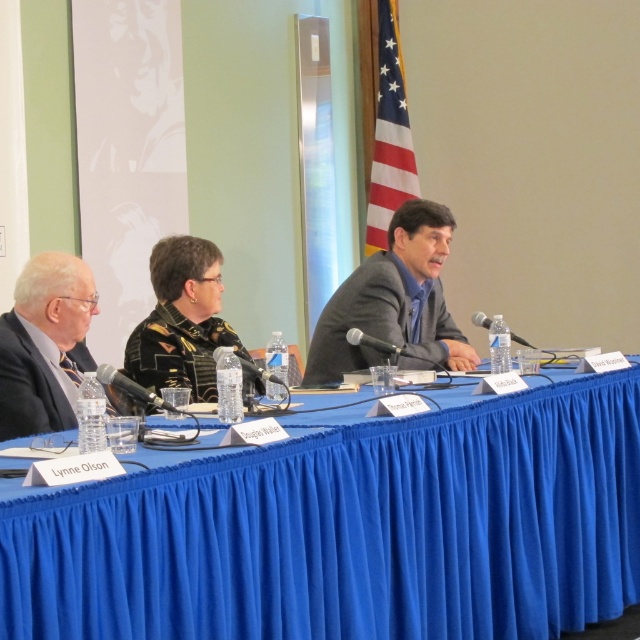
You are a photographer setting up for a group photo of the panel discussion. The blue fabric table at center is located at coordinates 0.831, 0.550. If you want to position your camera directly in front of the table, where should you place it?

The camera should be placed directly in front of the blue fabric table at center, which is located at coordinates (352, 531). Since the table is at this point, positioning the camera in front of it would align with these coordinates.

Consider the image. You are organizing a small event and need to place a 1.5 meter long banner between the blue fabric table at center and the American flag on the right. Can the banner fit in the space between them?

The space between the blue fabric table at center and the American flag on the right is 1.88 meters, so a 1.5 meter long banner can fit comfortably in that space.

You are organizing a photo shoot for a corporate event and need to ensure that the blue fabric table at center and the gray suit at center are both visible in the frame. Given their sizes, which object should you prioritize positioning closer to the camera to maintain clarity and detail?

The gray suit at center is smaller in size than the blue fabric table at center, so you should prioritize positioning the gray suit at center closer to the camera to ensure its details are clearly visible.